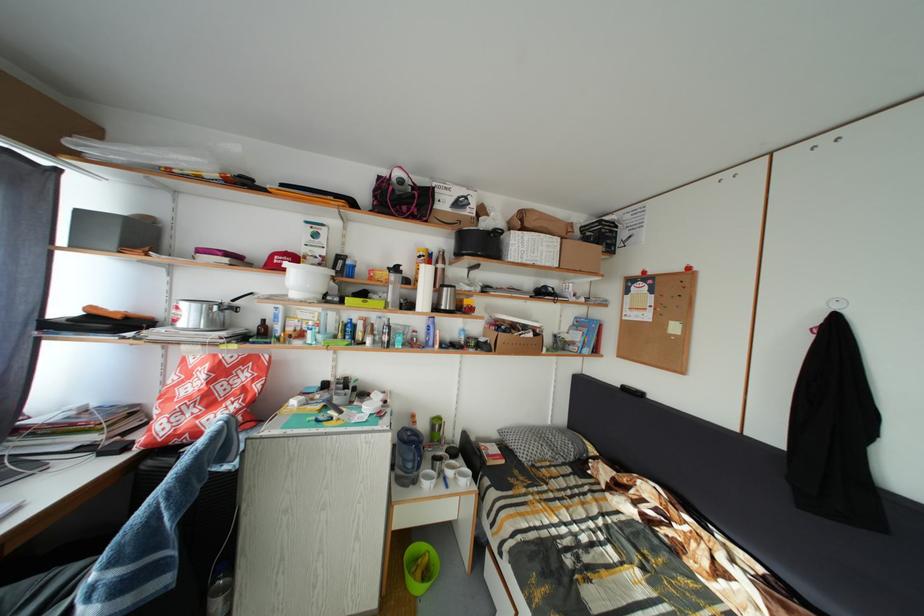
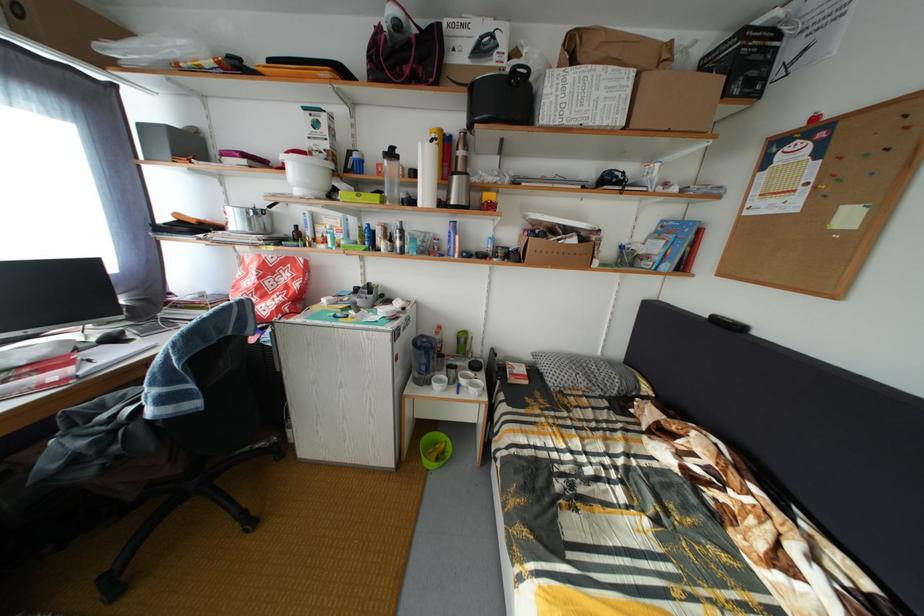
Locate, in the second image, the point that corresponds to point (424, 565) in the first image.

(444, 451)